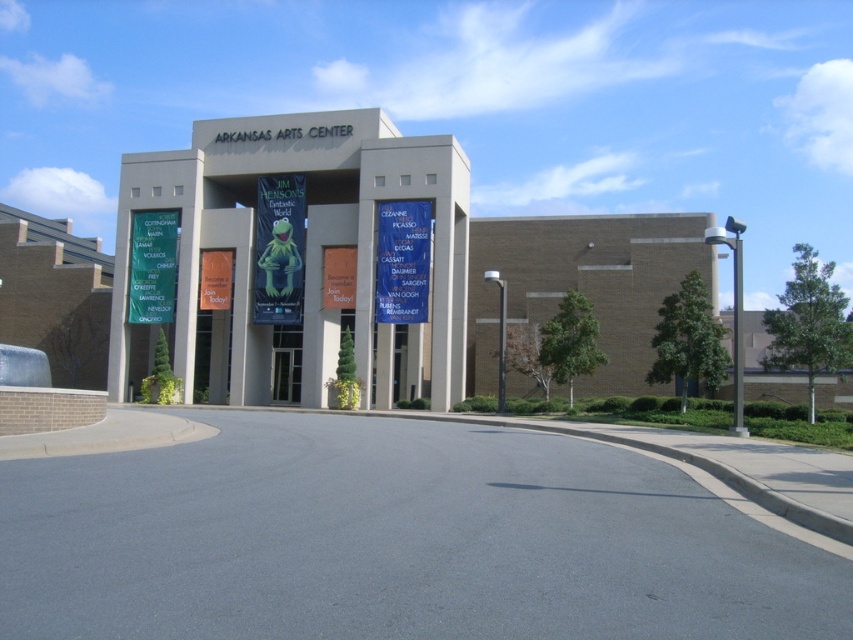
Question: Can you confirm if green fabric sign at left is bigger than matte green banner at center?

Choices:
 (A) yes
 (B) no

Answer: (A)

Question: Where is green matte kermit at center located in relation to matte green banner at center in the image?

Choices:
 (A) above
 (B) below

Answer: (B)

Question: Estimate the real-world distances between objects in this image. Which object is farther from the green fabric sign at left?

Choices:
 (A) matte green banner at center
 (B) blue glass sign at center

Answer: (B)

Question: In this image, where is green fabric sign at left located relative to orange fabric banner at center?

Choices:
 (A) right
 (B) left

Answer: (B)

Question: Based on their relative distances, which object is farther from the blue glass sign at center?

Choices:
 (A) green fabric sign at left
 (B) matte green banner at center
 (C) orange fabric banner at center
 (D) green matte kermit at center

Answer: (A)

Question: Which point appears farthest from the camera in this image?

Choices:
 (A) (264, 193)
 (B) (172, 307)
 (C) (225, 269)
 (D) (383, 234)

Answer: (B)